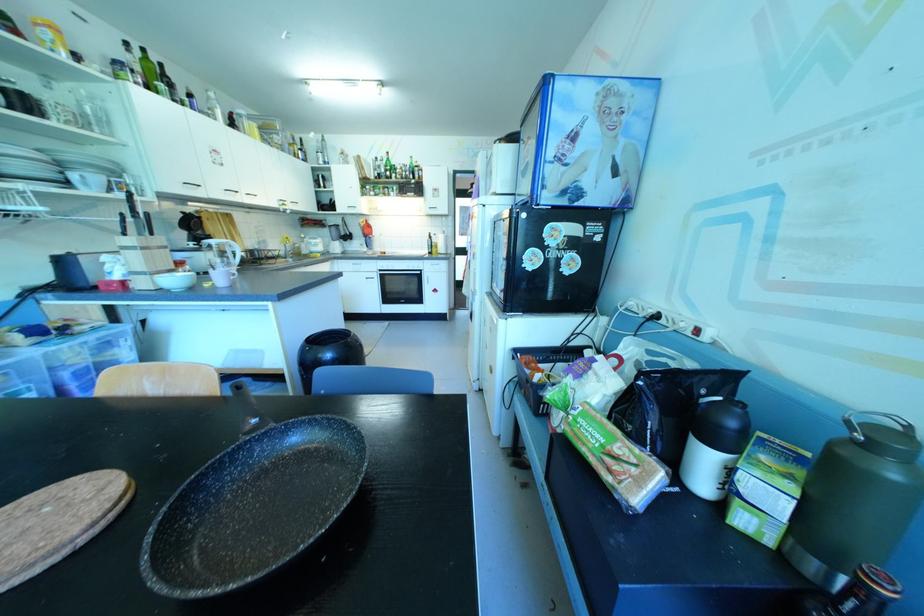
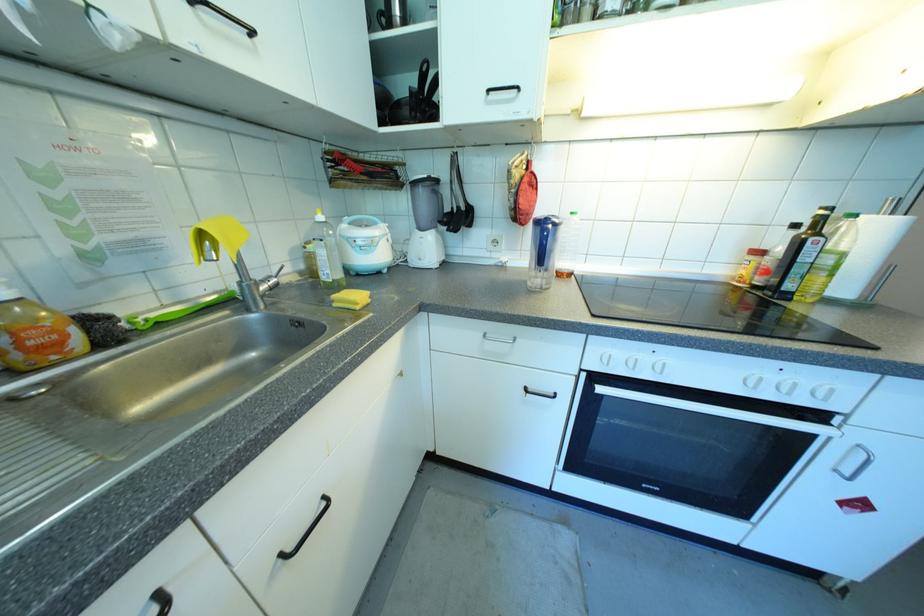
Which direction would the cameraman need to move to produce the second image?

The cameraman moved toward left, forward.